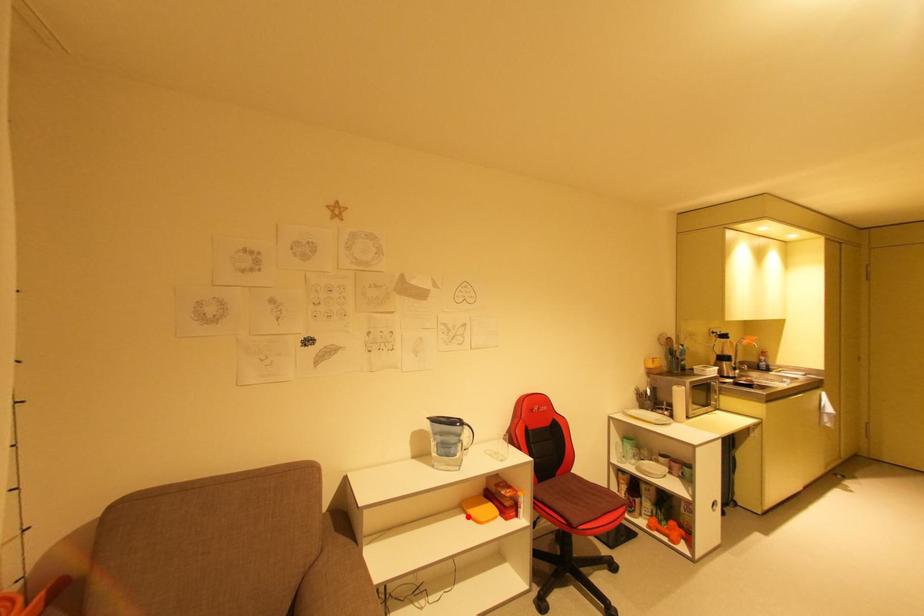
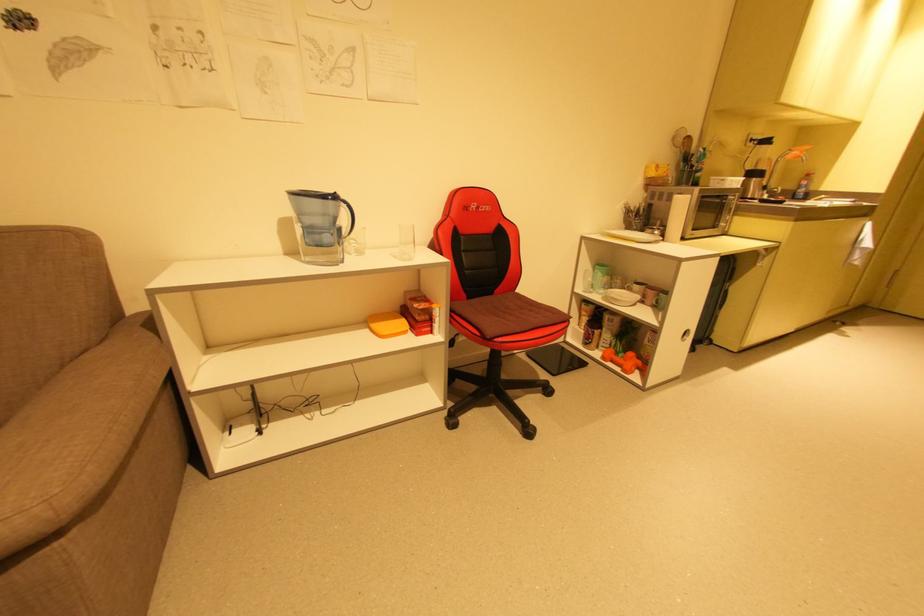
Question: A red point is marked in image1. In image2, is the corresponding 3D point closer to the camera or farther? Reply with the corresponding letter.

Choices:
 (A) The corresponding 3D point is closer.
 (B) The corresponding 3D point is farther.

Answer: (A)